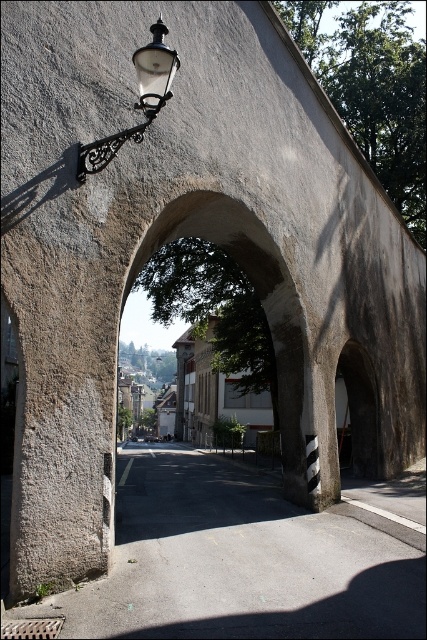
Question: Which object is closer to the camera taking this photo?

Choices:
 (A) gray concrete alley at center
 (B) matte black street light at upper left

Answer: (A)

Question: Does gray concrete alley at center come behind matte black street light at upper left?

Choices:
 (A) no
 (B) yes

Answer: (A)

Question: Can you confirm if gray concrete alley at center is positioned to the right of matte black street light at upper left?

Choices:
 (A) no
 (B) yes

Answer: (B)

Question: Which of the following is the farthest from the observer?

Choices:
 (A) (300, 305)
 (B) (155, 522)

Answer: (A)

Question: Estimate the real-world distances between objects in this image. Which object is closer to the smooth stone archway at center?

Choices:
 (A) gray concrete alley at center
 (B) matte black street light at upper left

Answer: (B)

Question: Is gray concrete alley at center above matte black street light at upper left?

Choices:
 (A) yes
 (B) no

Answer: (B)